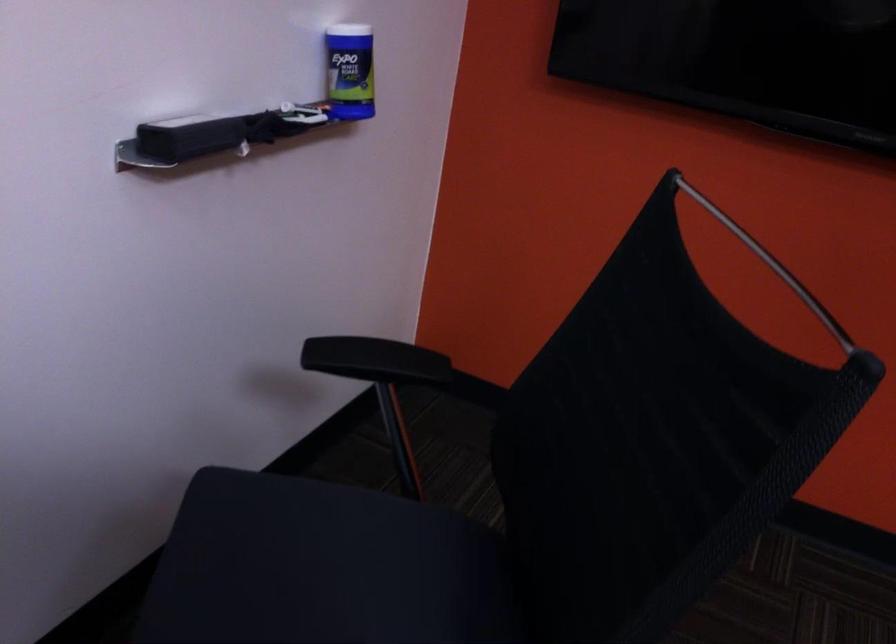
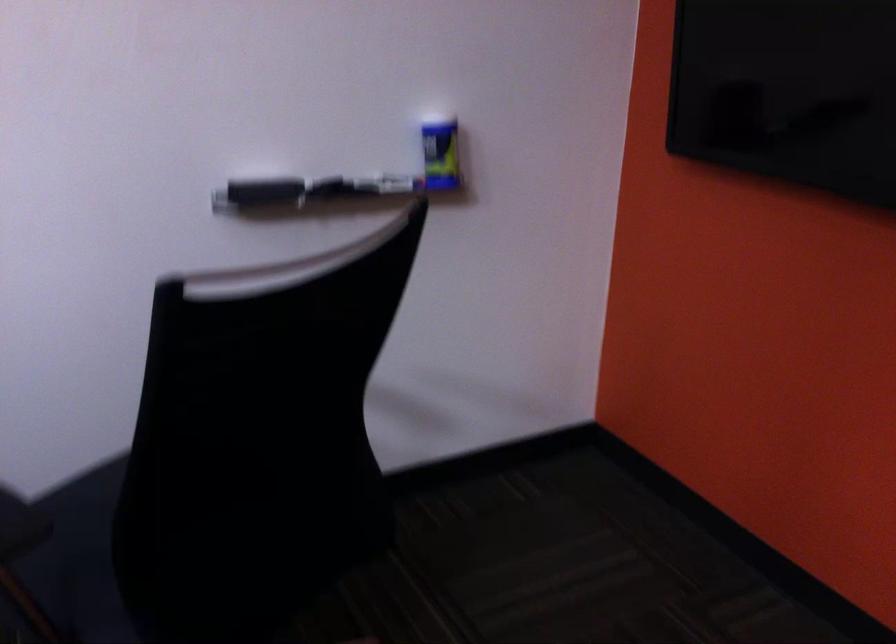
The point at (202, 145) is marked in the first image. Where is the corresponding point in the second image?

(261, 191)